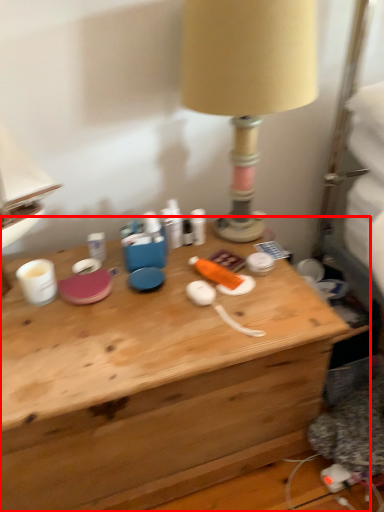
Question: From the image, what is the correct spatial relationship of desk (annotated by the red box) in relation to lamp?

Choices:
 (A) left
 (B) right

Answer: (A)